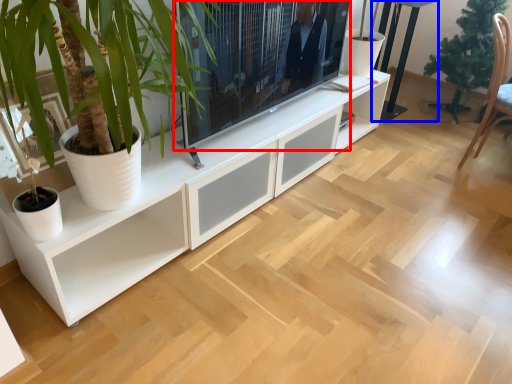
Question: Which of the following is the farthest to the observer, television (highlighted by a red box) or table (highlighted by a blue box)?

Choices:
 (A) television
 (B) table

Answer: (B)